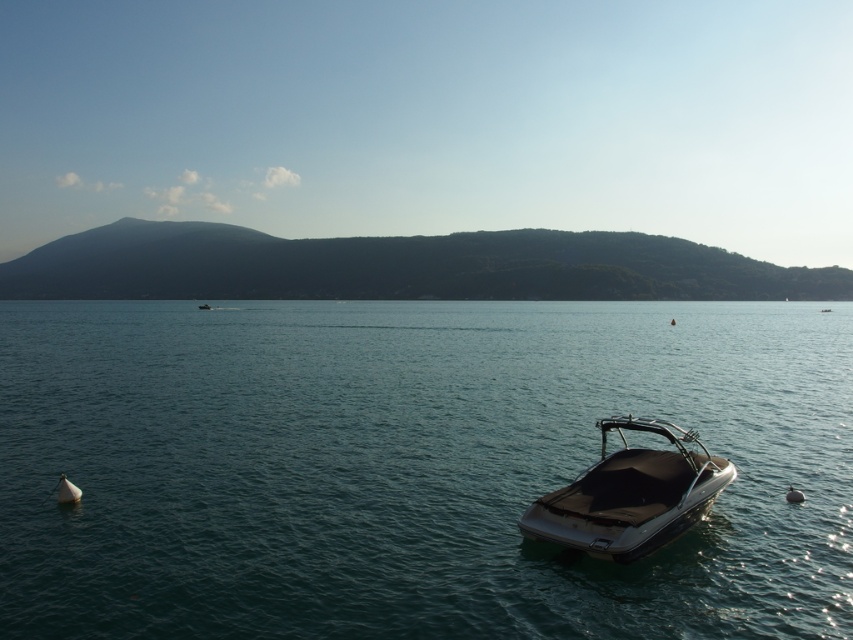
You are a photographer planning to capture the reflection of the shiny black boat at lower right on the clear blue water at center. Since reflections require the object to be near the water surface, will the boat be positioned appropriately for this?

The clear blue water at center is larger in size than the shiny black boat at lower right, so the boat is positioned near the water surface, making it suitable for capturing its reflection on the water.

You are standing on the lakeside and looking at the scene. Which object, the clear blue water at center or the shiny black boat at lower right, is positioned higher from the ground level?

The clear blue water at center is positioned higher than the shiny black boat at lower right because it is described as being above it.